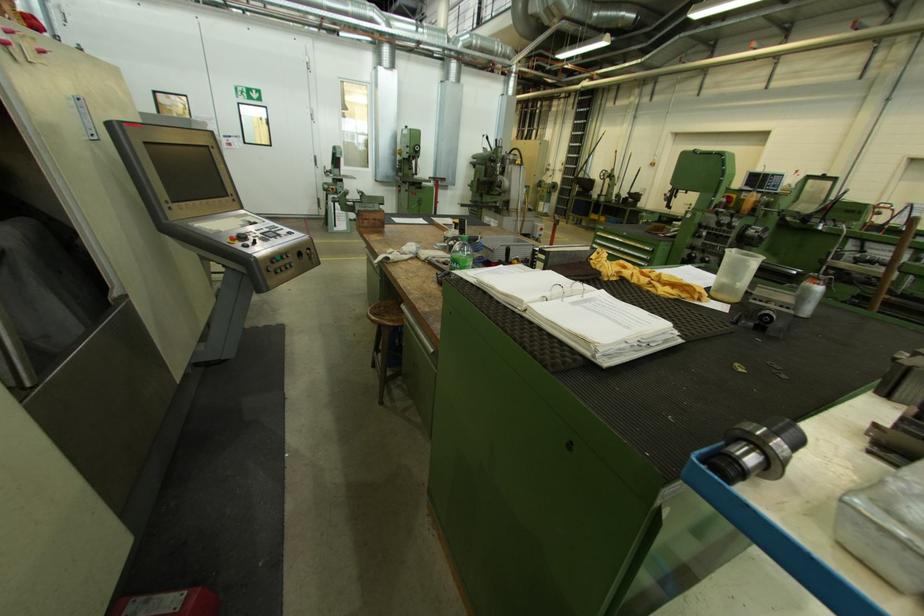
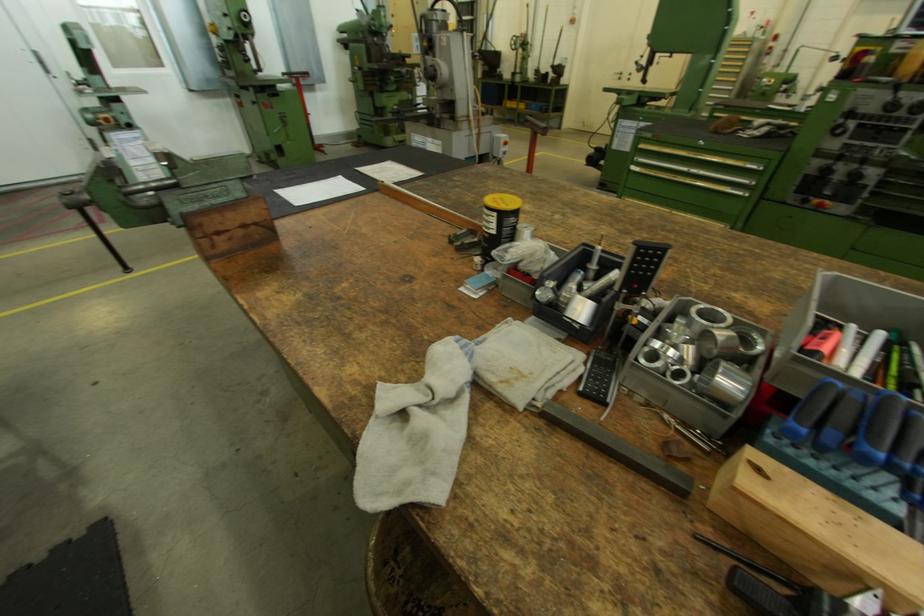
Where in the second image is the point corresponding to [671,196] from the first image?

(642, 63)